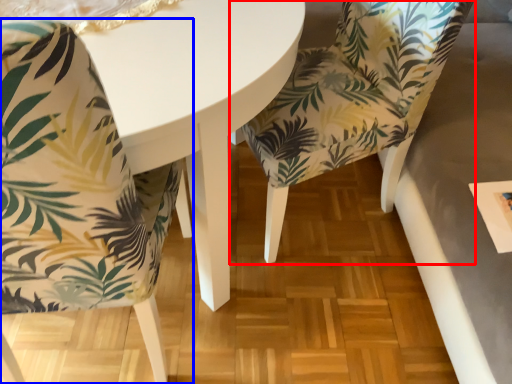
Question: Among these objects, which one is farthest to the camera, chair (highlighted by a red box) or chair (highlighted by a blue box)?

Choices:
 (A) chair
 (B) chair

Answer: (A)